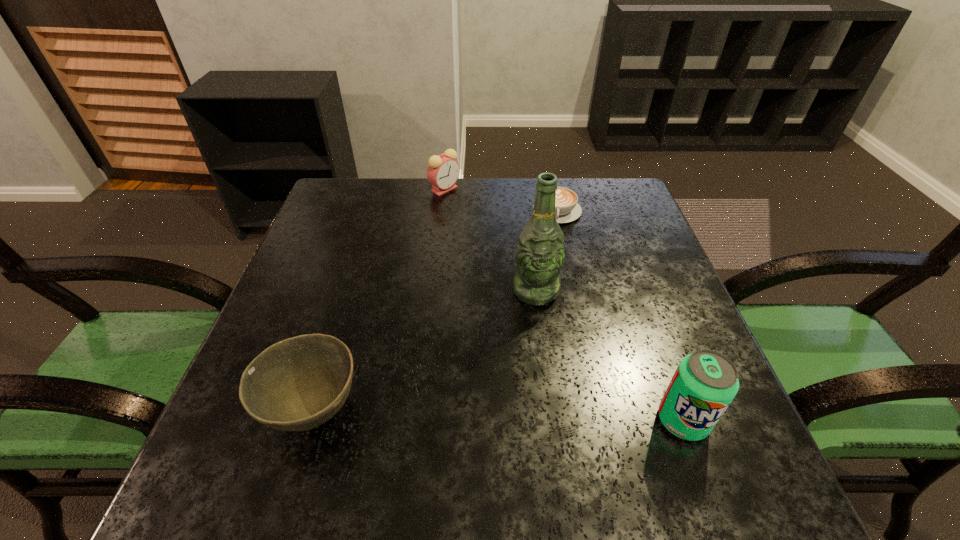
Image resolution: width=960 pixels, height=540 pixels. What are the coordinates of `vacant space located on the side of the shortest object with the handle` in the screenshot? It's located at (555, 283).

At what (x,y) coordinates should I click in order to perform the action: click on vacant space located on the side of the shortest object with the handle. Please return your answer as a coordinate pair (x, y). Looking at the image, I should click on (555, 283).

Find the location of a particular element. Image resolution: width=960 pixels, height=540 pixels. free point located on the side of the shortest object with the handle is located at coordinates (553, 321).

This screenshot has width=960, height=540. I want to click on free space located 0.300m on the face of the farthest object, so click(x=446, y=266).

The width and height of the screenshot is (960, 540). Find the location of `vacant point located on the face of the farthest object`. vacant point located on the face of the farthest object is located at coordinates (446, 260).

This screenshot has width=960, height=540. I want to click on free region located on the face of the farthest object, so click(446, 266).

Find the location of `free space located 0.080m on the surface of the third nearest object`. free space located 0.080m on the surface of the third nearest object is located at coordinates (538, 336).

I want to click on free location located on the surface of the third nearest object, so click(x=540, y=387).

Image resolution: width=960 pixels, height=540 pixels. In order to click on free space located 0.240m on the surface of the third nearest object in this screenshot , I will do `click(541, 406)`.

Find the location of a particular element. The height and width of the screenshot is (540, 960). cappuccino that is at the far edge is located at coordinates (567, 209).